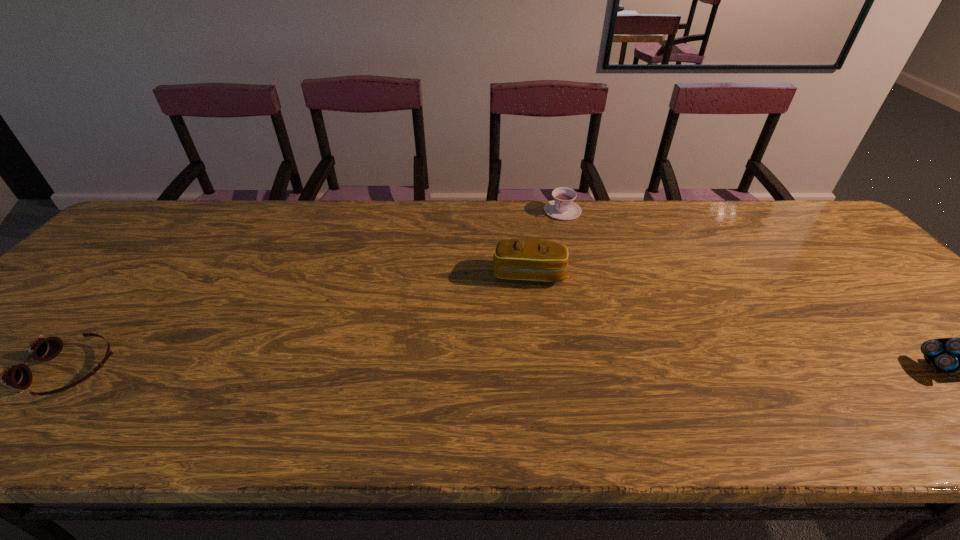
I want to click on object that is positioned at the far edge, so click(x=562, y=207).

At what (x,y) coordinates should I click in order to perform the action: click on object at the near edge. Please return your answer as a coordinate pair (x, y). Looking at the image, I should click on (19, 376).

Locate an element on the screen. object that is at the left edge is located at coordinates (19, 376).

Where is `object at the near left corner`? The image size is (960, 540). object at the near left corner is located at coordinates (19, 376).

The width and height of the screenshot is (960, 540). In the image, there is a desktop. Find the location of `vacant space at the far edge`. vacant space at the far edge is located at coordinates pyautogui.click(x=625, y=236).

You are a GUI agent. You are given a task and a screenshot of the screen. Output one action in this format:
    pyautogui.click(x=<x>, y=<y>)
    Task: Click on the free location at the near edge of the desktop
    
    Given the screenshot: What is the action you would take?
    pyautogui.click(x=238, y=374)

You are a GUI agent. You are given a task and a screenshot of the screen. Output one action in this format:
    pyautogui.click(x=<x>, y=<y>)
    Task: Click on the vacant space at the left edge of the desktop
    
    Given the screenshot: What is the action you would take?
    pyautogui.click(x=93, y=315)

At what (x,y) coordinates should I click in order to perform the action: click on free space at the right edge. Please return your answer as a coordinate pair (x, y). Image resolution: width=960 pixels, height=540 pixels. Looking at the image, I should click on (901, 349).

Locate an element on the screen. Image resolution: width=960 pixels, height=540 pixels. vacant space at the far right corner is located at coordinates (801, 227).

The height and width of the screenshot is (540, 960). I want to click on free spot between the teacup and the leftmost object, so click(x=317, y=291).